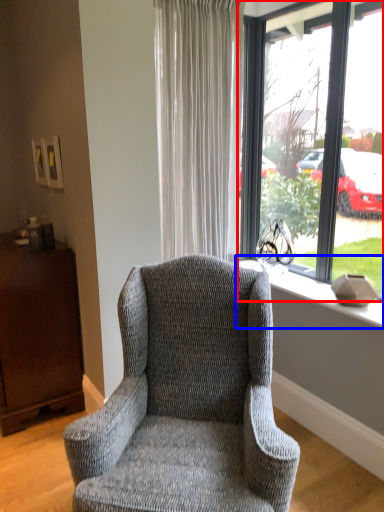
Question: Which point is closer to the camera, window (highlighted by a red box) or window sill (highlighted by a blue box)?

Choices:
 (A) window
 (B) window sill

Answer: (A)